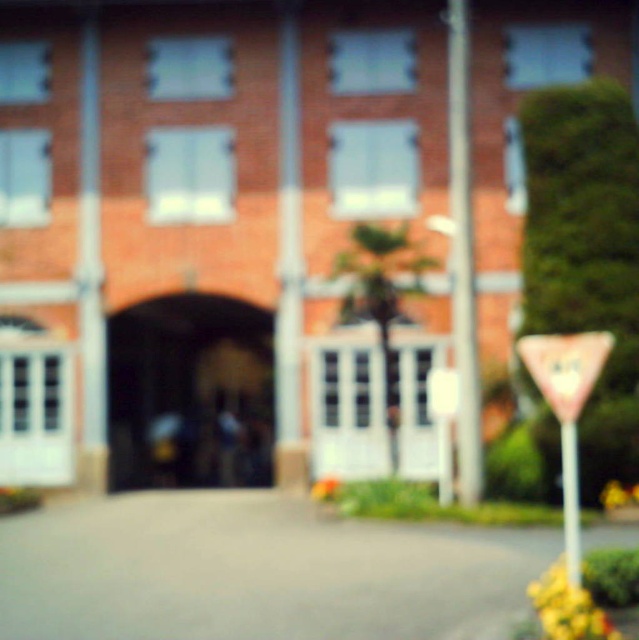
Question: Which of the following is the farthest from the observer?

Choices:
 (A) (567, 525)
 (B) (569, 388)
 (C) (543, 378)

Answer: (C)

Question: Can you confirm if pink paper stop sign at right is positioned above white plastic pole at right?

Choices:
 (A) no
 (B) yes

Answer: (B)

Question: Is pink plastic triangle at lower right behind pink paper stop sign at right?

Choices:
 (A) no
 (B) yes

Answer: (B)

Question: Which object is farther from the camera taking this photo?

Choices:
 (A) white plastic pole at right
 (B) pink plastic triangle at lower right

Answer: (A)

Question: Is the position of metallic pole at center less distant than that of white plastic pole at right?

Choices:
 (A) yes
 (B) no

Answer: (B)

Question: Estimate the real-world distances between objects in this image. Which object is closer to the pink paper stop sign at right?

Choices:
 (A) pink plastic triangle at lower right
 (B) white plastic pole at right
 (C) metallic pole at center

Answer: (A)